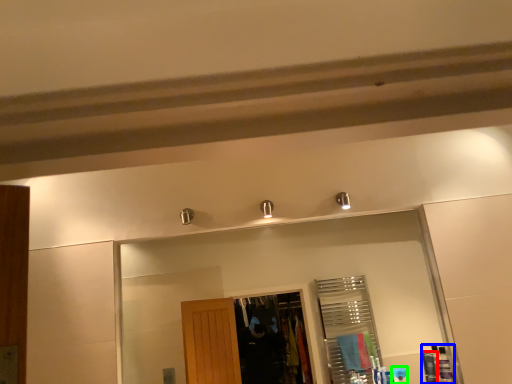
Question: Estimate the real-world distances between objects in this image. Which object is farther from toiletry (highlighted by a red box), toiletry (highlighted by a blue box) or toiletry (highlighted by a green box)?

Choices:
 (A) toiletry
 (B) toiletry

Answer: (B)